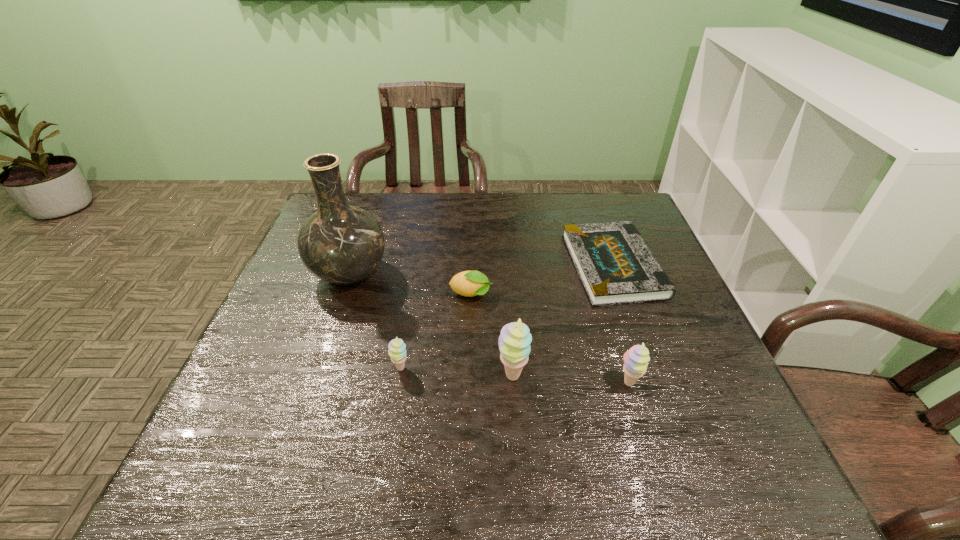
You are a GUI agent. You are given a task and a screenshot of the screen. Output one action in this format:
    pyautogui.click(x=<x>, y=<y>)
    Task: Click on the free spot between the leftmost sherbert and the vase
    The image size is (960, 540).
    Given the screenshot: What is the action you would take?
    pyautogui.click(x=375, y=321)

I want to click on vacant area that lies between the tallest object and the fourth shortest object, so click(x=489, y=329).

Image resolution: width=960 pixels, height=540 pixels. What are the coordinates of `free space between the tallest object and the second sherbert from right to left` in the screenshot? It's located at (431, 325).

Find the location of a particular element. The height and width of the screenshot is (540, 960). free space between the tallest object and the notebook is located at coordinates (481, 271).

Find the location of a particular element. The width and height of the screenshot is (960, 540). unoccupied area between the fourth object from left to right and the tallest object is located at coordinates (431, 325).

Locate an element on the screen. Image resolution: width=960 pixels, height=540 pixels. vacant area that lies between the second sherbert from left to right and the leftmost object is located at coordinates (431, 325).

The width and height of the screenshot is (960, 540). In order to click on free space between the fifth shortest object and the fifth tallest object in this screenshot , I will do `click(492, 335)`.

You are a GUI agent. You are given a task and a screenshot of the screen. Output one action in this format:
    pyautogui.click(x=<x>, y=<y>)
    Task: Click on the fourth closest object to the vase
    The image size is (960, 540).
    Given the screenshot: What is the action you would take?
    pyautogui.click(x=615, y=265)

Identify the location of object identified as the fourth closest to the fifth object from right to left. This screenshot has height=540, width=960. (615, 265).

At what (x,y) coordinates should I click in order to perform the action: click on sherbert that is the third closest to the vase. Please return your answer as a coordinate pair (x, y). This screenshot has height=540, width=960. Looking at the image, I should click on (636, 359).